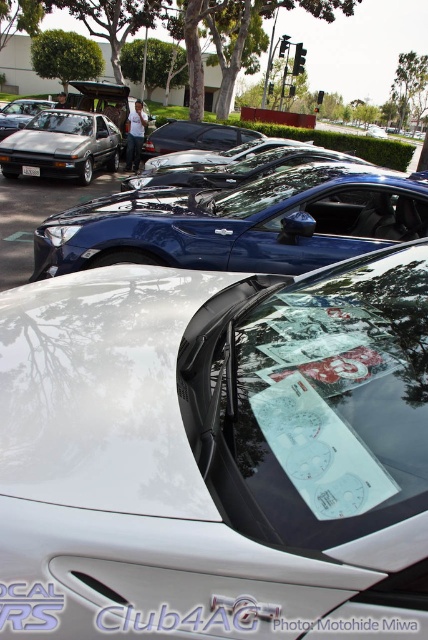
Is white glossy car at center further to the viewer compared to clear glass windshield at center?

No, it is in front of clear glass windshield at center.

This screenshot has height=640, width=428. I want to click on white glossy car at center, so click(216, 452).

Does point (253, 470) lie behind point (62, 177)?

No, it is in front of (62, 177).

Between white glossy car at center and metallic silver hatchback at left, which one is positioned lower?

white glossy car at center is lower down.

This screenshot has height=640, width=428. Find the location of `white glossy car at center`. white glossy car at center is located at coordinates (216, 452).

Can you confirm if matte black windshield at center is smaller than matte black car at left?

Correct, matte black windshield at center occupies less space than matte black car at left.

Can you confirm if matte black windshield at center is positioned to the left of matte black car at left?

Answer: No, matte black windshield at center is not to the left of matte black car at left.

Which is behind, point (47, 116) or point (32, 104)?

Point (32, 104)

In order to click on matte black windshield at center in this screenshot , I will do `click(62, 122)`.